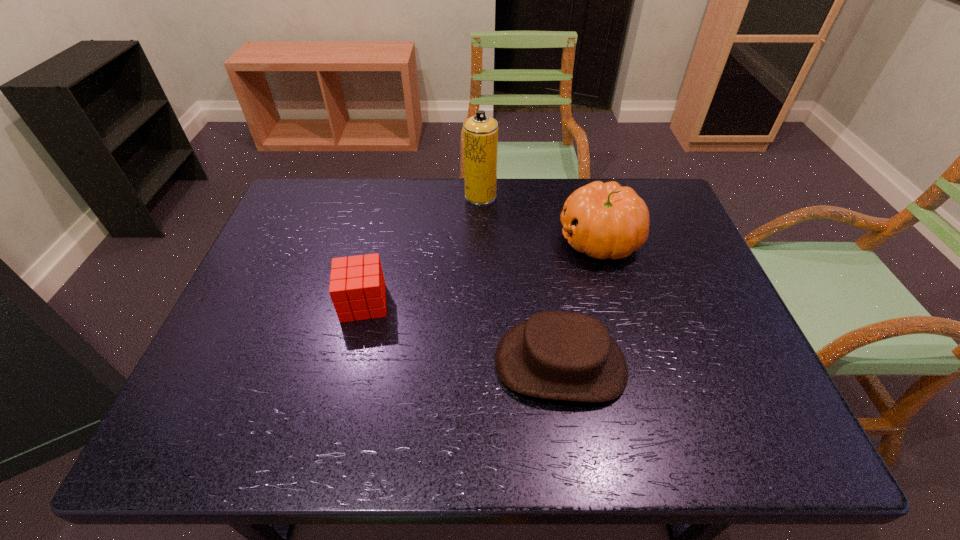
You are a GUI agent. You are given a task and a screenshot of the screen. Output one action in this format:
    pyautogui.click(x=<x>, y=<y>)
    Task: Click on the farthest object
    The width and height of the screenshot is (960, 540).
    Given the screenshot: What is the action you would take?
    pyautogui.click(x=480, y=132)

Identify the location of aerosol can. The height and width of the screenshot is (540, 960). coord(480,132).

I want to click on pumpkin, so click(604, 220).

You are a GUI agent. You are given a task and a screenshot of the screen. Output one action in this format:
    pyautogui.click(x=<x>, y=<y>)
    Task: Click on the second tallest object
    This screenshot has height=540, width=960.
    Given the screenshot: What is the action you would take?
    pyautogui.click(x=604, y=220)

Where is `cube`? This screenshot has height=540, width=960. cube is located at coordinates (357, 288).

At what (x,y) coordinates should I click in order to perform the action: click on the leftmost object. Please return your answer as a coordinate pair (x, y). This screenshot has height=540, width=960. Looking at the image, I should click on (357, 288).

The height and width of the screenshot is (540, 960). In order to click on hat in this screenshot , I will do `click(557, 355)`.

Locate an element on the screen. The image size is (960, 540). free space located 0.110m on the front of the aerosol can is located at coordinates (481, 228).

Identify the location of free region located on the carved face of the pumpkin. click(454, 240).

You are a GUI agent. You are given a task and a screenshot of the screen. Output one action in this format:
    pyautogui.click(x=<x>, y=<y>)
    Task: Click on the free point located on the carved face of the pumpkin
    Image resolution: width=960 pixels, height=540 pixels.
    Given the screenshot: What is the action you would take?
    pyautogui.click(x=450, y=240)